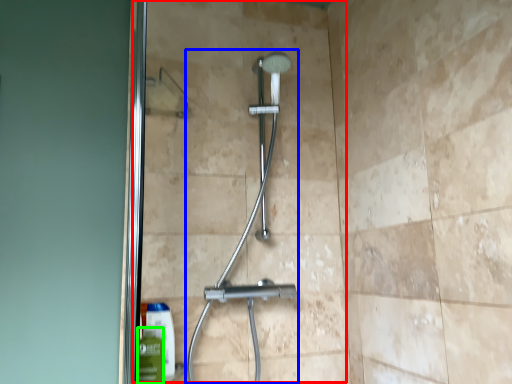
Question: Which is farther away from glass door (highlighted by a red box)? shower (highlighted by a blue box) or mouthwash (highlighted by a green box)?

Choices:
 (A) shower
 (B) mouthwash

Answer: (B)